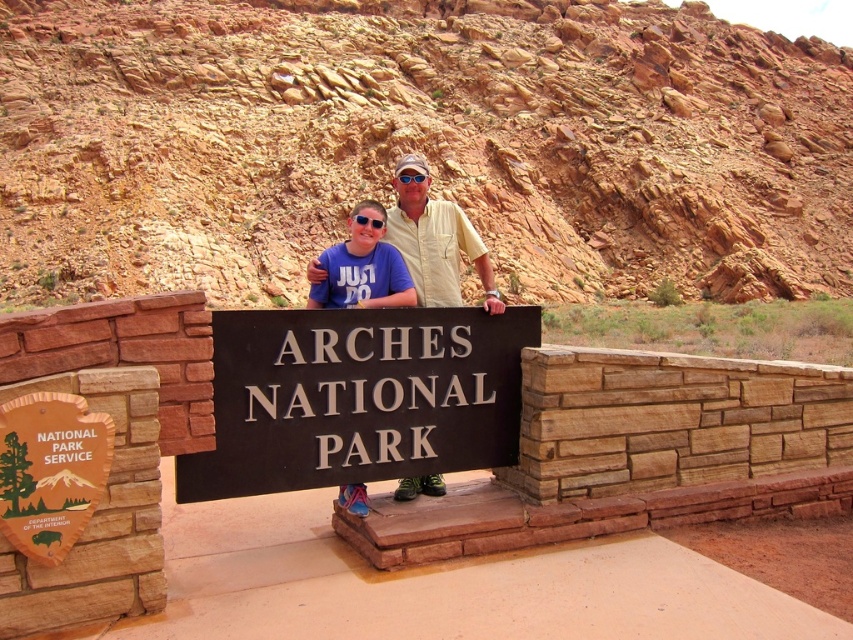
What do you see at coordinates (434, 243) in the screenshot? I see `matte yellow shirt at center` at bounding box center [434, 243].

Does matte yellow shirt at center have a greater height compared to blue fabric shirt at center?

Yes.

Which is behind, point (421, 195) or point (328, 250)?

The point (328, 250) is behind.

Locate an element on the screen. This screenshot has height=640, width=853. matte yellow shirt at center is located at coordinates click(x=434, y=243).

Which is above, black metal sign at center or blue fabric shirt at center?

blue fabric shirt at center is above.

Does black metal sign at center have a lesser width compared to blue fabric shirt at center?

Yes, black metal sign at center is thinner than blue fabric shirt at center.

This screenshot has height=640, width=853. Find the location of `black metal sign at center`. black metal sign at center is located at coordinates [357, 396].

Can you confirm if black metal sign at center is smaller than matte yellow shirt at center?

Indeed, black metal sign at center has a smaller size compared to matte yellow shirt at center.

Which is more to the right, black metal sign at center or matte yellow shirt at center?

black metal sign at center is more to the right.

Is point (427, 464) farther from viewer compared to point (416, 163)?

That is False.

Find the location of a particular element. black metal sign at center is located at coordinates tap(357, 396).